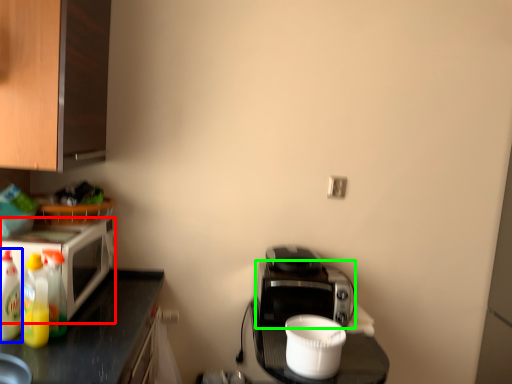
Question: Estimate the real-world distances between objects in this image. Which object is closer to microwave oven (highlighted by a red box), bottle (highlighted by a blue box) or appliance (highlighted by a green box)?

Choices:
 (A) bottle
 (B) appliance

Answer: (A)